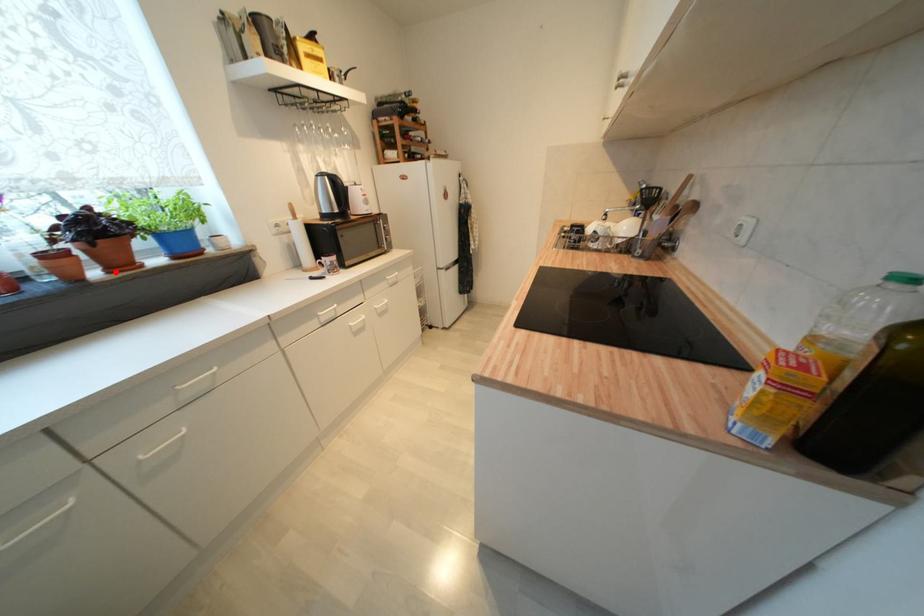
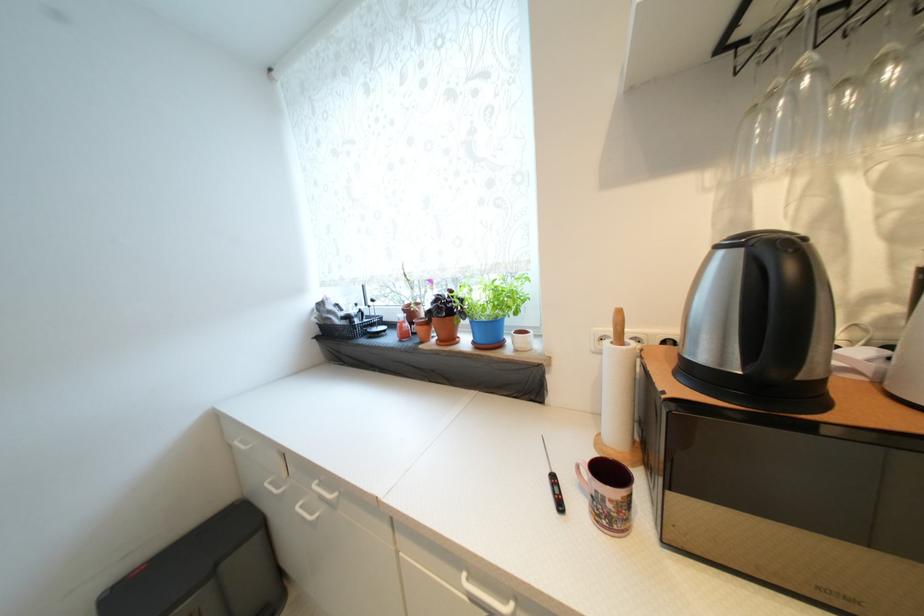
The point at the highlighted location is marked in the first image. Where is the corresponding point in the second image?

(445, 342)